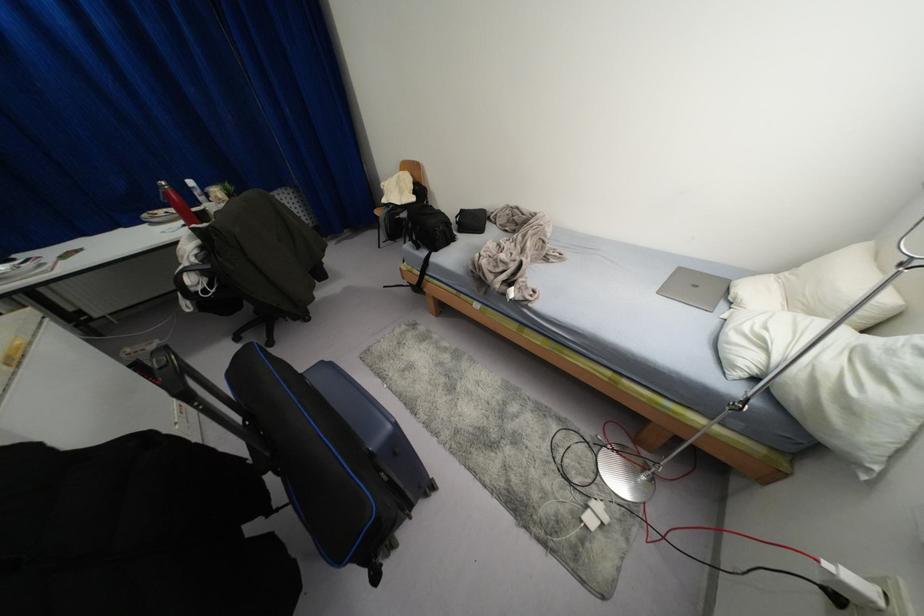
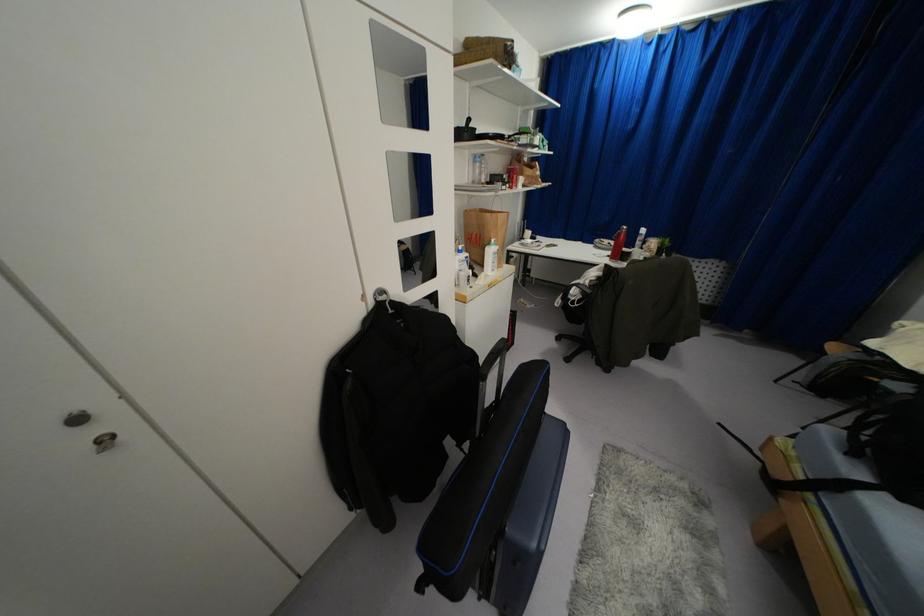
The point at (165, 193) is marked in the first image. Where is the corresponding point in the second image?

(618, 233)